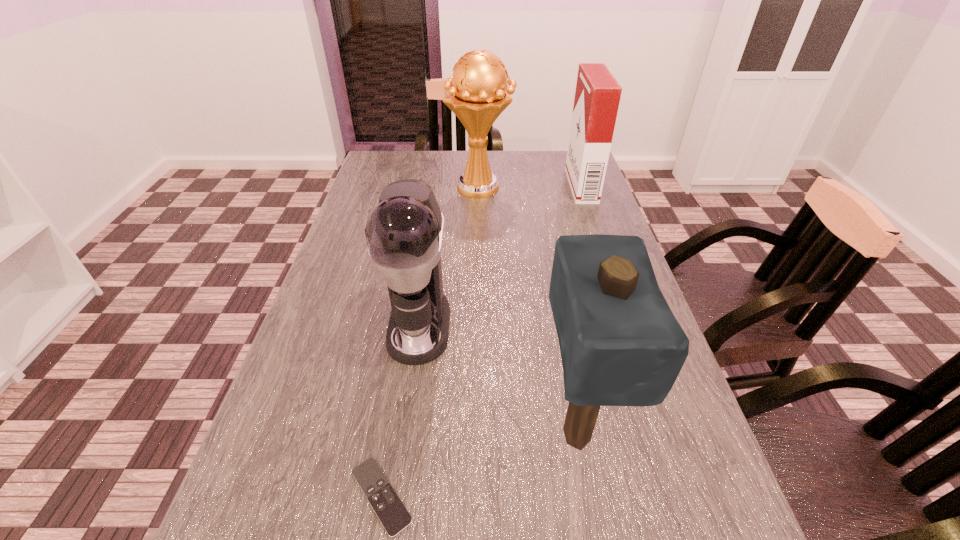
Where is `object that is the third closest one to the trophy_cup`? object that is the third closest one to the trophy_cup is located at coordinates (620, 344).

Find the location of a particular element. The image size is (960, 540). free region that satisfies the following two spatial constraints: 1. at the front of the trophy_cup where the globe is prominent; 2. place cup under the spout of the coffee maker is located at coordinates (480, 326).

Identify the location of vacant position in the image that satisfies the following two spatial constraints: 1. on the front-facing side of the rightmost object; 2. place cup under the spout of the coffee maker. (630, 326).

You are a GUI agent. You are given a task and a screenshot of the screen. Output one action in this format:
    pyautogui.click(x=<x>, y=<y>)
    Task: Click on the vacant point that satisfies the following two spatial constraints: 1. at the front of the trophy_cup where the globe is prominent; 2. on the right side of the mallet
    This screenshot has height=540, width=960.
    Given the screenshot: What is the action you would take?
    pyautogui.click(x=480, y=434)

At what (x,y) coordinates should I click in order to perform the action: click on free space that satisfies the following two spatial constraints: 1. at the front of the trophy_cup where the globe is prominent; 2. place cup under the spout of the third farthest object. Please return your answer as a coordinate pair (x, y). This screenshot has width=960, height=540. Looking at the image, I should click on (480, 326).